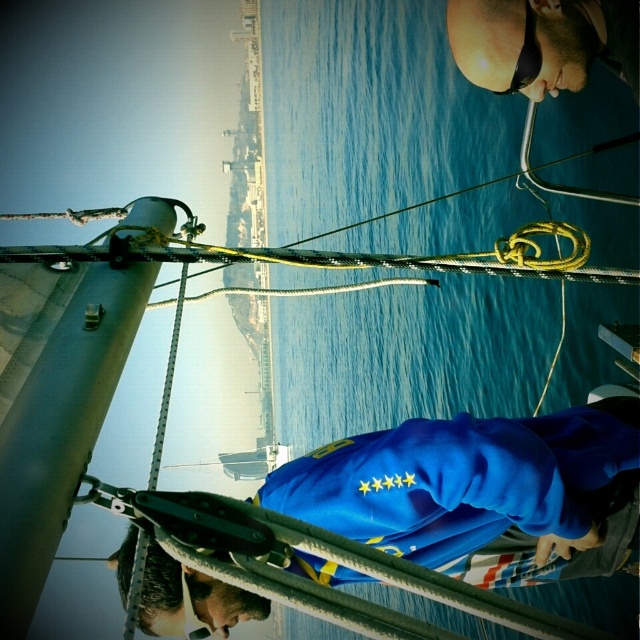
Question: Observing the image, what is the correct spatial positioning of blue fabric at center in reference to sunglasses at upper center?

Choices:
 (A) right
 (B) left

Answer: (B)

Question: Which point is farther to the camera?

Choices:
 (A) (388, 465)
 (B) (573, 64)

Answer: (B)

Question: Which point is farther from the camera taking this photo?

Choices:
 (A) (516, 60)
 (B) (563, 573)

Answer: (B)

Question: Can you confirm if blue fabric at center is positioned below sunglasses at upper center?

Choices:
 (A) no
 (B) yes

Answer: (B)

Question: Is blue fabric at center above sunglasses at upper center?

Choices:
 (A) no
 (B) yes

Answer: (A)